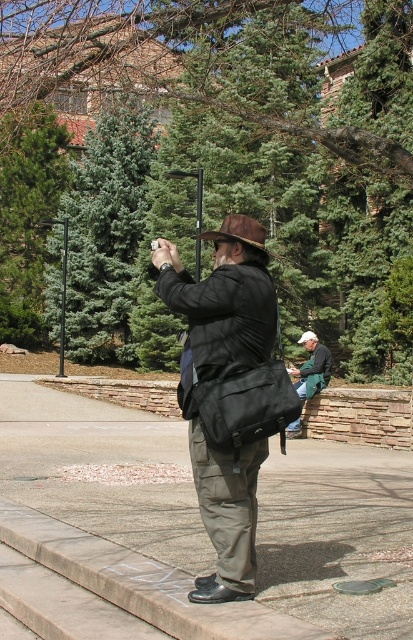
Is the position of concrete pavement at center less distant than that of matte black bag at center?

That is True.

Can you confirm if concrete pavement at center is thinner than matte black bag at center?

Incorrect, concrete pavement at center's width is not less than matte black bag at center's.

Between point (73, 454) and point (177, 388), which one is positioned behind?

The point (177, 388) is more distant.

Image resolution: width=413 pixels, height=640 pixels. In order to click on concrete pavement at center in this screenshot , I will do `click(337, 536)`.

Between blue-green foliage at center and green pine tree at upper left, which one has less height?

green pine tree at upper left

Does blue-green foliage at center have a smaller size compared to green pine tree at upper left?

No, blue-green foliage at center is not smaller than green pine tree at upper left.

Is point (121, 237) behind point (18, 292)?

No, it is not.

Where is `blue-green foliage at center`? This screenshot has width=413, height=640. blue-green foliage at center is located at coordinates (106, 230).

Which is behind, point (239, 10) or point (109, 108)?

Point (109, 108)

Is green needle-like leaves at center above blue-green foliage at center?

Yes, green needle-like leaves at center is above blue-green foliage at center.

Which is behind, point (377, 4) or point (87, 301)?

The point (87, 301) is more distant.

Identify the location of green needle-like leaves at center. (265, 150).